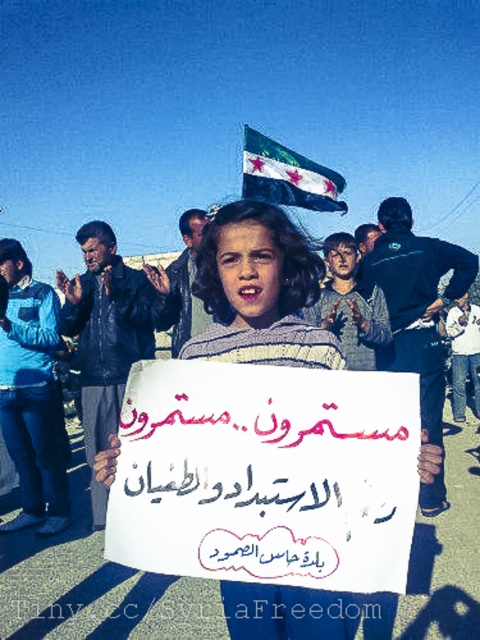
Question: Is white striped sweater at center positioned at the back of dark blue fabric flag at upper center?

Choices:
 (A) yes
 (B) no

Answer: (B)

Question: Is white striped sweater at center bigger than dark blue fabric flag at upper center?

Choices:
 (A) no
 (B) yes

Answer: (A)

Question: Which point appears farthest from the camera in this image?

Choices:
 (A) (287, 227)
 (B) (256, 161)

Answer: (B)

Question: In this image, where is white striped sweater at center located relative to dark blue fabric flag at upper center?

Choices:
 (A) above
 (B) below

Answer: (B)

Question: Which point is farther to the camera?

Choices:
 (A) dark blue fabric flag at upper center
 (B) white striped sweater at center

Answer: (A)